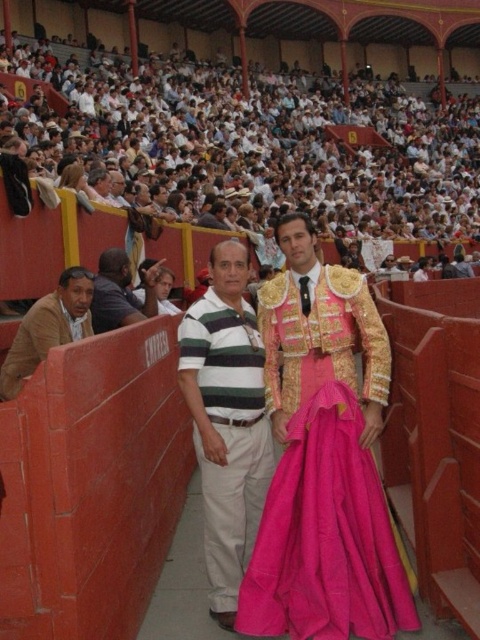
You are a photographer positioned at the front of the arena. You want to take a photo of both the green striped shirt at center and the dark blue shirt at left. However, you can only focus on one person at a time. Which shirt should you focus on first to ensure the other is still visible in the background?

You should focus on the green striped shirt at center first because it is in front of the dark blue shirt at left, so the dark blue shirt at left will still be visible in the background when the green striped shirt at center is in focus.

You are a photographer positioned at the center of the arena. You want to take a photo of both the pink satin dress at center and the brown leather jacket at left. The camera you are using has a maximum focusing range of 10 meters. Will you be able to capture both subjects clearly in the same photo?

The pink satin dress at center is 10.84 meters away from the brown leather jacket at left. Since the camera can only focus up to 10 meters, the distance between them exceeds the maximum focusing range. Therefore, you cannot capture both subjects clearly in the same photo.